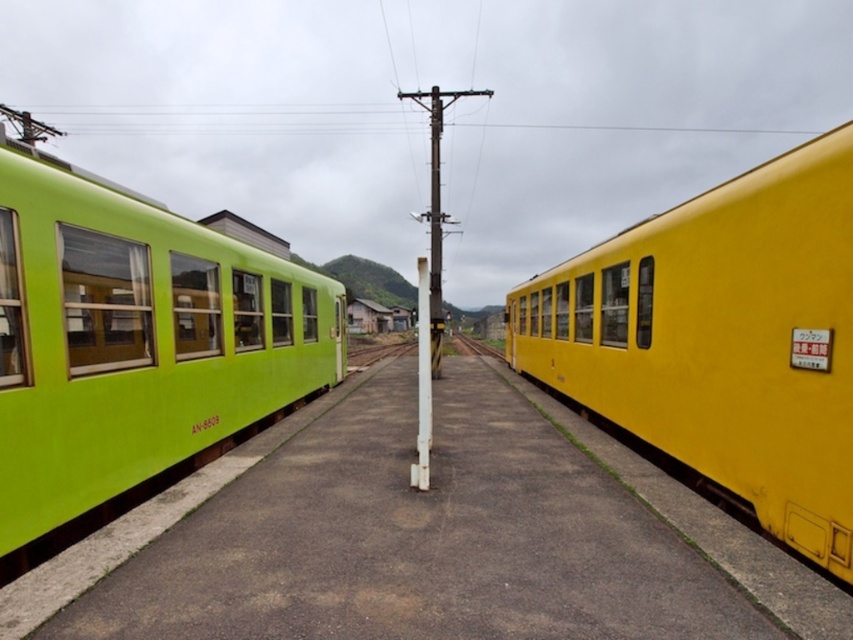
Is matte green train at left wider than smooth metal train track at center?

Yes.

The height and width of the screenshot is (640, 853). What do you see at coordinates (426, 536) in the screenshot?
I see `matte green train at left` at bounding box center [426, 536].

Image resolution: width=853 pixels, height=640 pixels. Find the location of `matte green train at left`. matte green train at left is located at coordinates (426, 536).

Does point (407, 342) come closer to viewer compared to point (457, 333)?

Yes, point (407, 342) is in front of point (457, 333).

Who is more forward, (373, 356) or (492, 346)?

Point (373, 356) is in front.

Where is `smooth concrete train track at center`? The height and width of the screenshot is (640, 853). smooth concrete train track at center is located at coordinates (376, 352).

Is lime green plastic train at left to the left of smooth concrete train track at center from the viewer's perspective?

Indeed, lime green plastic train at left is positioned on the left side of smooth concrete train track at center.

Is lime green plastic train at left positioned in front of smooth concrete train track at center?

Yes, it is.

This screenshot has width=853, height=640. Describe the element at coordinates (132, 348) in the screenshot. I see `lime green plastic train at left` at that location.

At what (x,y) coordinates should I click in order to perform the action: click on lime green plastic train at left. Please return your answer as a coordinate pair (x, y). This screenshot has width=853, height=640. Looking at the image, I should click on (132, 348).